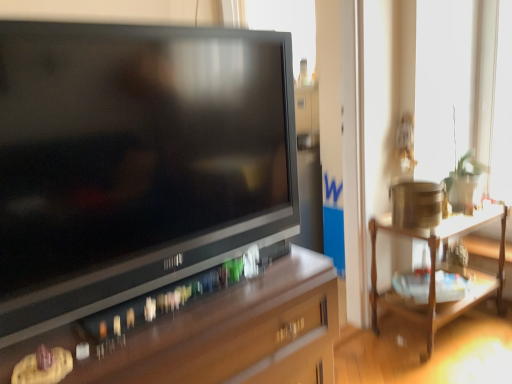
Question: Should I look upward or downward to see wooden table at right?

Choices:
 (A) down
 (B) up

Answer: (A)

Question: Considering the relative sizes of matte black television at center and brown wood desk at lower left in the image provided, is matte black television at center shorter than brown wood desk at lower left?

Choices:
 (A) no
 (B) yes

Answer: (A)

Question: Is matte black television at center to the left of brown wood desk at lower left from the viewer's perspective?

Choices:
 (A) yes
 (B) no

Answer: (B)

Question: Does matte black television at center have a greater width compared to brown wood desk at lower left?

Choices:
 (A) yes
 (B) no

Answer: (B)

Question: Is matte black television at center further to the viewer compared to brown wood desk at lower left?

Choices:
 (A) no
 (B) yes

Answer: (A)

Question: Does matte black television at center have a greater height compared to brown wood desk at lower left?

Choices:
 (A) no
 (B) yes

Answer: (B)

Question: Is matte black television at center far away from brown wood desk at lower left?

Choices:
 (A) yes
 (B) no

Answer: (B)

Question: Is wooden table at right not within brown wood desk at lower left?

Choices:
 (A) no
 (B) yes

Answer: (B)

Question: Is wooden table at right aimed at brown wood desk at lower left?

Choices:
 (A) no
 (B) yes

Answer: (A)

Question: Is wooden table at right to the left of brown wood desk at lower left from the viewer's perspective?

Choices:
 (A) yes
 (B) no

Answer: (B)

Question: Does wooden table at right have a lesser height compared to brown wood desk at lower left?

Choices:
 (A) no
 (B) yes

Answer: (B)

Question: From the image's perspective, would you say wooden table at right is positioned over brown wood desk at lower left?

Choices:
 (A) no
 (B) yes

Answer: (B)

Question: Would you consider wooden table at right to be distant from brown wood desk at lower left?

Choices:
 (A) yes
 (B) no

Answer: (A)

Question: From a real-world perspective, is wooden table at right beneath matte black television at center?

Choices:
 (A) yes
 (B) no

Answer: (A)